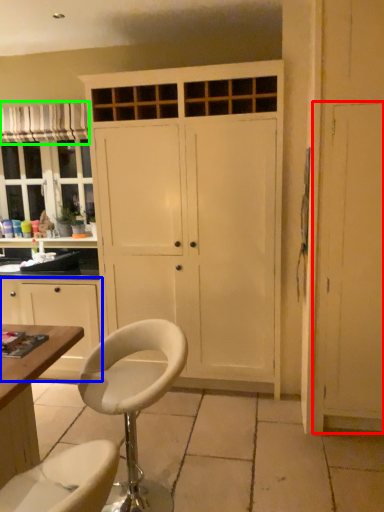
Question: Which object is the closest to the screen door (highlighted by a red box)? Choose among these: cabinetry (highlighted by a blue box) or curtain (highlighted by a green box).

Choices:
 (A) cabinetry
 (B) curtain

Answer: (A)